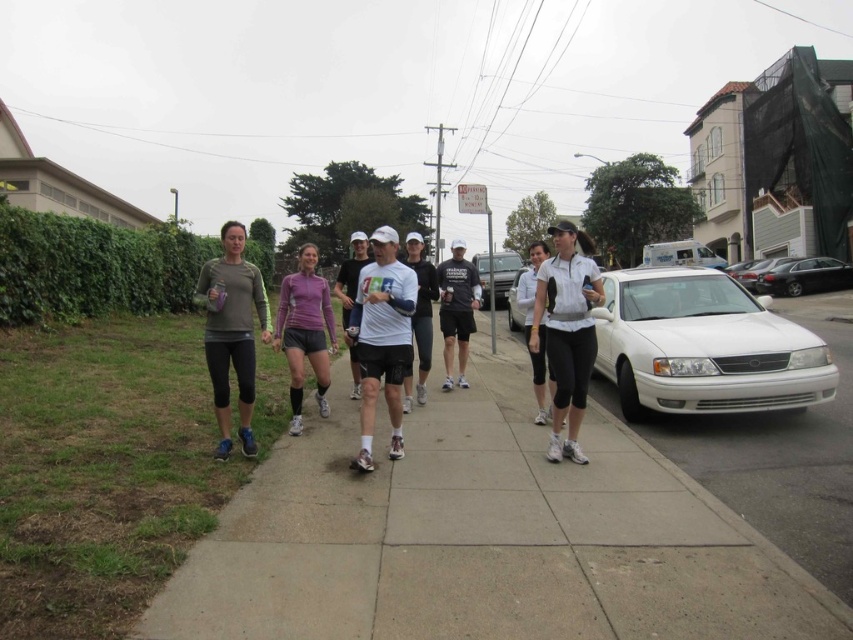
Between point (801, 385) and point (424, 394), which one is positioned behind?

The point (424, 394) is behind.

Is white glossy sedan at right smaller than white matte cap at center?

Incorrect, white glossy sedan at right is not smaller in size than white matte cap at center.

I want to click on white glossy sedan at right, so click(703, 346).

Does white glossy sedan at right appear over black cotton t-shirt at center?

Actually, white glossy sedan at right is below black cotton t-shirt at center.

Between point (635, 300) and point (442, 288), which one is positioned behind?

The point (442, 288) is more distant.

Is point (624, 352) positioned after point (473, 280)?

No, (624, 352) is closer to viewer.

I want to click on white glossy sedan at right, so point(703,346).

Looking at this image, is matte green long-sleeve shirt at center thinner than black cotton t-shirt at center?

No, matte green long-sleeve shirt at center is not thinner than black cotton t-shirt at center.

Is matte green long-sleeve shirt at center to the left of black cotton t-shirt at center from the viewer's perspective?

Yes, matte green long-sleeve shirt at center is to the left of black cotton t-shirt at center.

Is point (247, 440) more distant than point (450, 380)?

No, it is not.

Locate an element on the screen. matte green long-sleeve shirt at center is located at coordinates (231, 332).